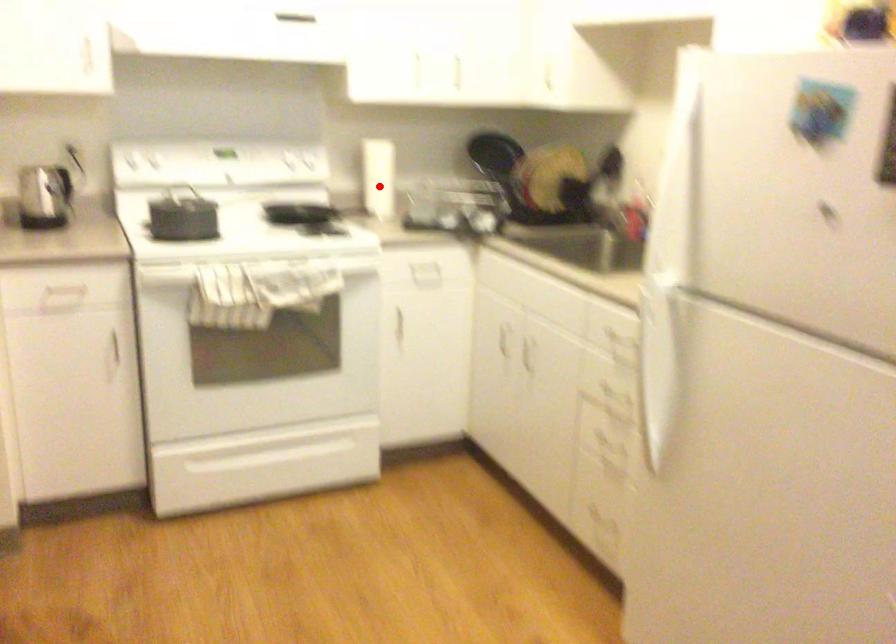
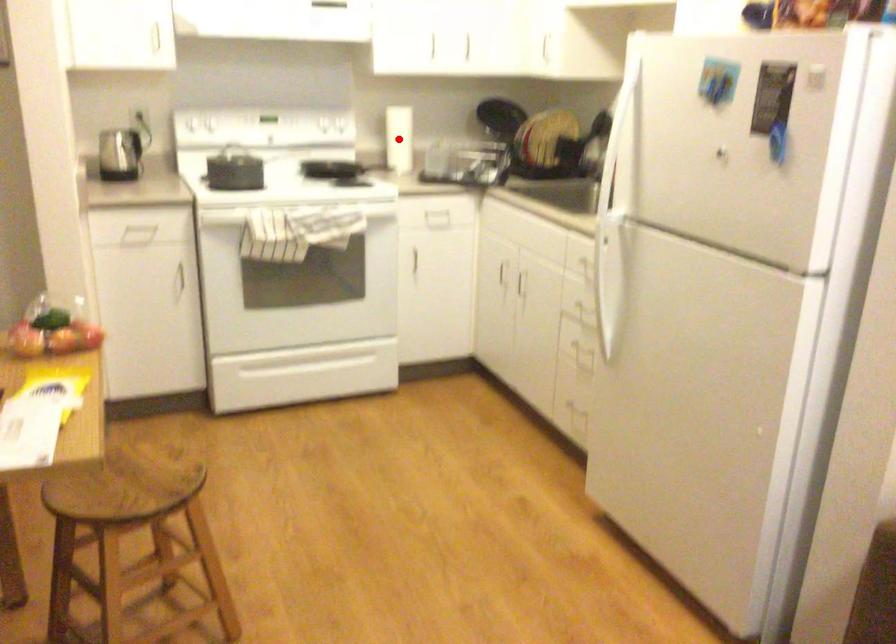
I am providing you with two images of the same scene from different viewpoints. A red point is marked on the first image and another point is marked on the second image. Is the marked point in image1 the same physical position as the marked point in image2?

Yes